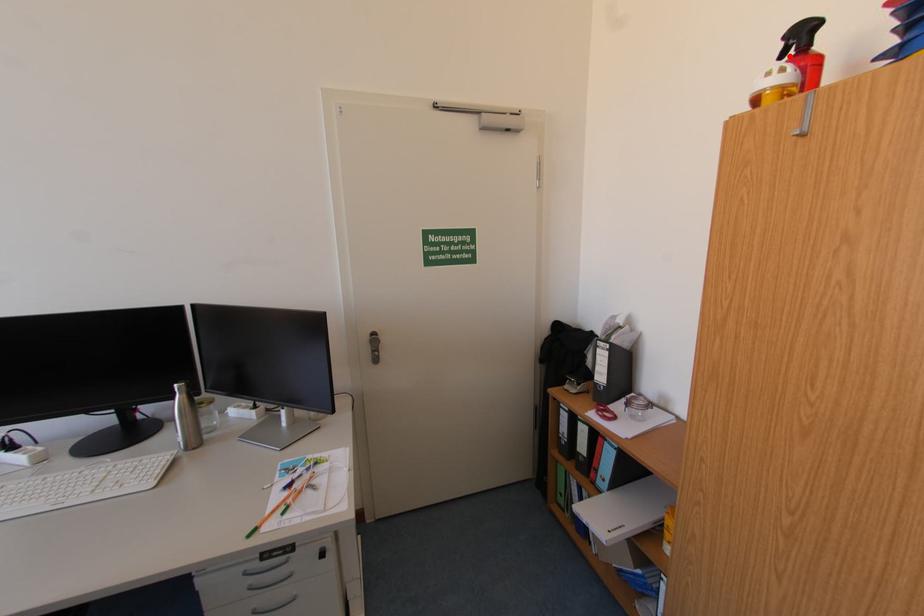
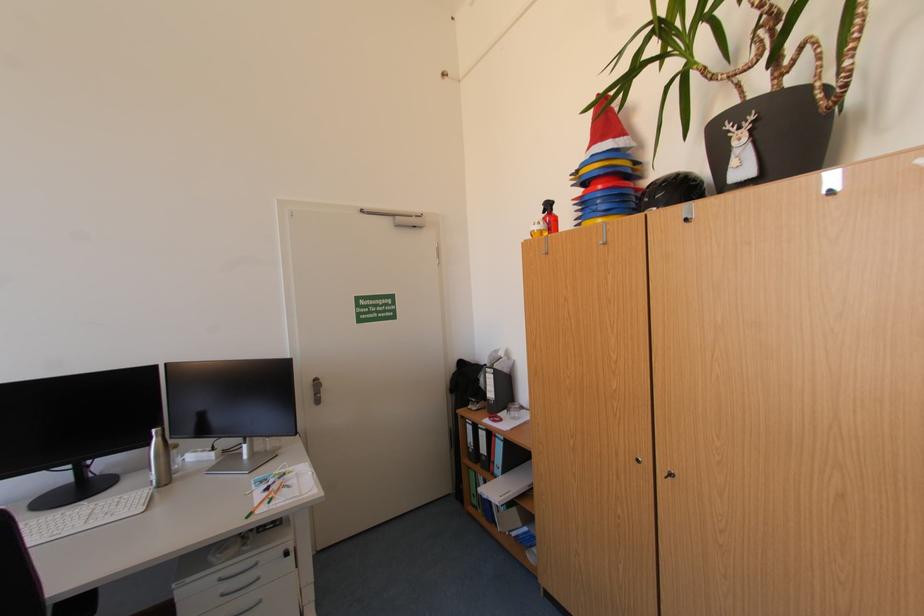
Question: I am providing you with two images of the same scene from different viewpoints. Image1 has a red point marked. In image2, the corresponding 3D location appears at what relative position? Reply with the corresponding letter.

Choices:
 (A) Closer
 (B) Farther

Answer: (A)